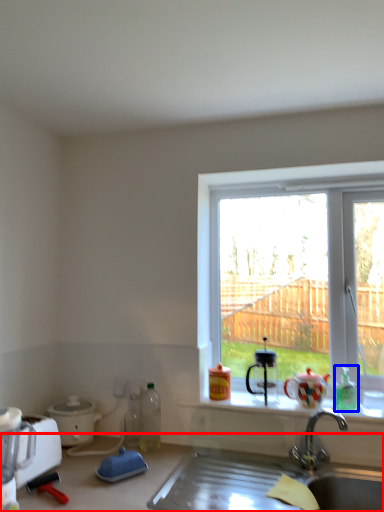
Question: Which point is closer to the camera, countertop (highlighted by a red box) or bottle (highlighted by a blue box)?

Choices:
 (A) countertop
 (B) bottle

Answer: (A)